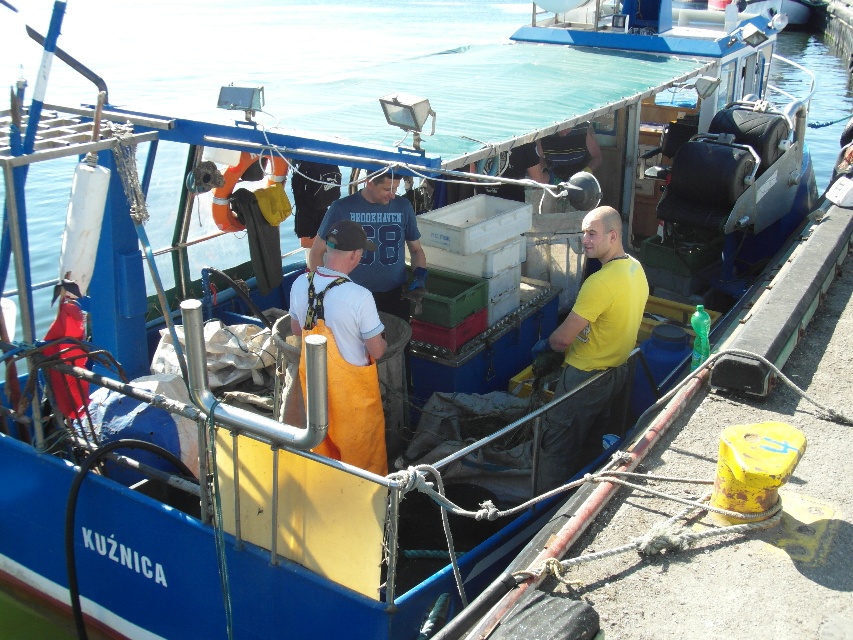
Question: Is yellow matte shirt at center bigger than matte blue t-shirt at center?

Choices:
 (A) no
 (B) yes

Answer: (B)

Question: Which object is closer to the camera taking this photo?

Choices:
 (A) yellow matte shirt at center
 (B) matte blue t-shirt at center

Answer: (A)

Question: Is yellow matte shirt at center closer to the viewer compared to matte blue t-shirt at center?

Choices:
 (A) yes
 (B) no

Answer: (A)

Question: Among these points, which one is nearest to the camera?

Choices:
 (A) (335, 355)
 (B) (576, 433)

Answer: (A)

Question: Among these points, which one is farthest from the camera?

Choices:
 (A) (381, 260)
 (B) (602, 432)

Answer: (A)

Question: Does orange waterproof overalls at center come in front of matte blue t-shirt at center?

Choices:
 (A) no
 (B) yes

Answer: (B)